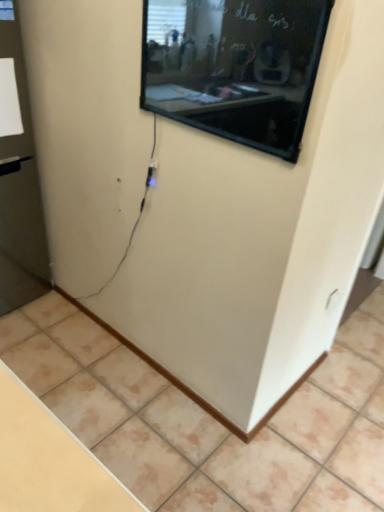
Question: Can you confirm if transparent glass door at left is positioned to the right of beige tile at lower center?

Choices:
 (A) yes
 (B) no

Answer: (B)

Question: Considering the relative sizes of transparent glass door at left and beige tile at lower center in the image provided, is transparent glass door at left taller than beige tile at lower center?

Choices:
 (A) no
 (B) yes

Answer: (B)

Question: From the image's perspective, would you say transparent glass door at left is shown under beige tile at lower center?

Choices:
 (A) no
 (B) yes

Answer: (A)

Question: Is transparent glass door at left smaller than beige tile at lower center?

Choices:
 (A) no
 (B) yes

Answer: (A)

Question: Is transparent glass door at left far from beige tile at lower center?

Choices:
 (A) no
 (B) yes

Answer: (A)

Question: Is transparent glass door at left turned away from beige tile at lower center?

Choices:
 (A) no
 (B) yes

Answer: (A)

Question: Does beige tile at lower center come behind black glossy screen at upper center?

Choices:
 (A) yes
 (B) no

Answer: (A)

Question: Is beige tile at lower center outside black glossy screen at upper center?

Choices:
 (A) yes
 (B) no

Answer: (A)

Question: From the image's perspective, is beige tile at lower center located beneath black glossy screen at upper center?

Choices:
 (A) no
 (B) yes

Answer: (B)

Question: Can you confirm if beige tile at lower center is thinner than black glossy screen at upper center?

Choices:
 (A) no
 (B) yes

Answer: (A)

Question: Is beige tile at lower center far from black glossy screen at upper center?

Choices:
 (A) no
 (B) yes

Answer: (B)

Question: From the image's perspective, does beige tile at lower center appear higher than black glossy screen at upper center?

Choices:
 (A) no
 (B) yes

Answer: (A)

Question: Is black glossy screen at upper center further to camera compared to transparent glass door at left?

Choices:
 (A) no
 (B) yes

Answer: (A)